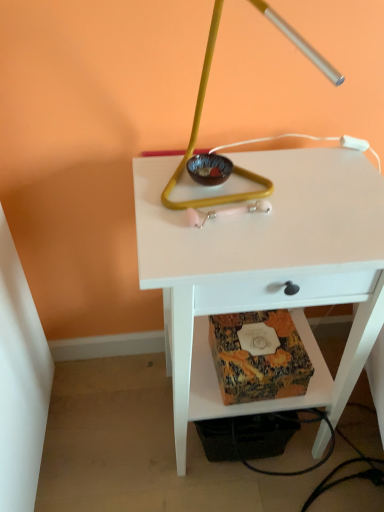
Locate an element on the screen. The image size is (384, 512). free spot above patterned paper at lower center (from a real-world perspective) is located at coordinates (258, 336).